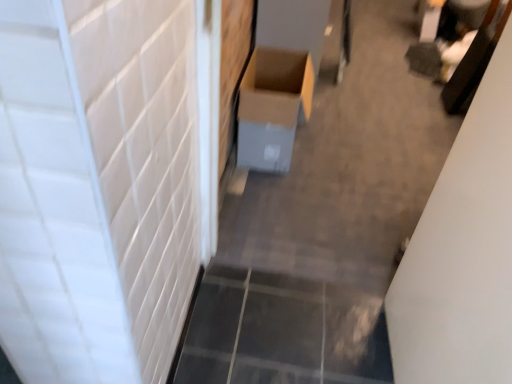
The height and width of the screenshot is (384, 512). Identify the location of vacant space in front of cardboard box at center. (271, 208).